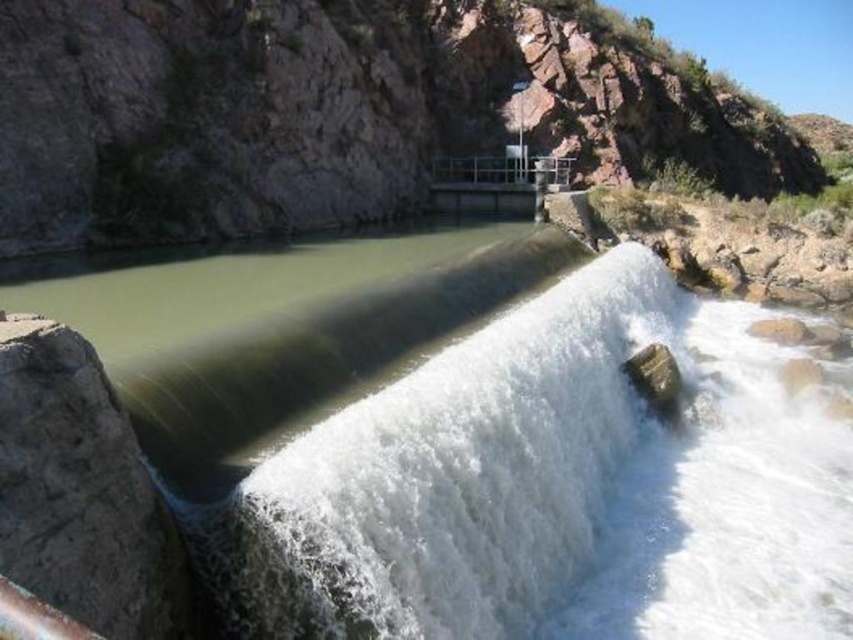
You are standing on the dam spillway and want to cross to the other side. You see the white frothy water at center and the brown rough stone at lower left. Which object is closer to you, and which is farther away?

The white frothy water at center is closer to you, while the brown rough stone at lower left is farther away because the description states the white frothy water at center is further to the viewer than brown rough stone at lower left. Wait, there might be a confusion here. Let me check again. The description says the white frothy water at center is further to the viewer than the brown rough stone at lower left. Wait, no, the description says white frothy water at center is further to the viewer than brown.

You are standing on the dam spillway and see the white frothy water at center and the brown rough stone at lower left. Which object is higher in elevation?

The white frothy water at center is taller than the brown rough stone at lower left, so it has a higher elevation.

You are standing at the edge of the spillway and notice two features in the image. One is the white frothy water at center and the other is the brown rough stone at lower left. Which of these two features is positioned more to the right from your viewpoint?

The white frothy water at center is to the right of the brown rough stone at lower left, so it is positioned more to the right from your viewpoint.